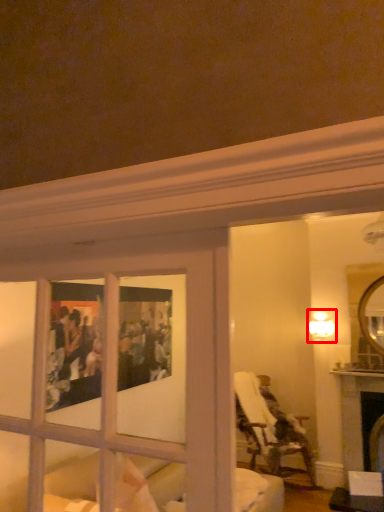
Question: From the image's perspective, where is light fixture (annotated by the red box) located in relation to chair in the image?

Choices:
 (A) below
 (B) above

Answer: (B)